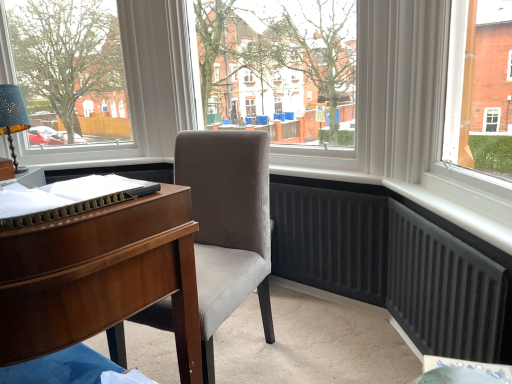
Question: From the image's perspective, is transparent glass window at center located above velvet grey chair at center?

Choices:
 (A) yes
 (B) no

Answer: (A)

Question: Is transparent glass window at center wider than velvet grey chair at center?

Choices:
 (A) no
 (B) yes

Answer: (A)

Question: Can you confirm if transparent glass window at center is thinner than velvet grey chair at center?

Choices:
 (A) yes
 (B) no

Answer: (A)

Question: Is transparent glass window at center far away from velvet grey chair at center?

Choices:
 (A) no
 (B) yes

Answer: (A)

Question: Does transparent glass window at center appear on the left side of velvet grey chair at center?

Choices:
 (A) no
 (B) yes

Answer: (A)

Question: Is transparent glass window at center further to camera compared to velvet grey chair at center?

Choices:
 (A) no
 (B) yes

Answer: (B)

Question: Considering the relative sizes of matte blue lampshade at left and transparent glass window at center in the image provided, is matte blue lampshade at left thinner than transparent glass window at center?

Choices:
 (A) yes
 (B) no

Answer: (A)

Question: From a real-world perspective, is matte blue lampshade at left on top of transparent glass window at center?

Choices:
 (A) yes
 (B) no

Answer: (B)

Question: Does matte blue lampshade at left lie in front of transparent glass window at center?

Choices:
 (A) no
 (B) yes

Answer: (A)

Question: Considering the relative sizes of matte blue lampshade at left and transparent glass window at center in the image provided, is matte blue lampshade at left wider than transparent glass window at center?

Choices:
 (A) yes
 (B) no

Answer: (B)

Question: Would you say matte blue lampshade at left contains transparent glass window at center?

Choices:
 (A) no
 (B) yes

Answer: (A)

Question: Is matte blue lampshade at left not inside transparent glass window at center?

Choices:
 (A) yes
 (B) no

Answer: (A)

Question: Is transparent glass window at center not near matte white frame at upper left?

Choices:
 (A) yes
 (B) no

Answer: (B)